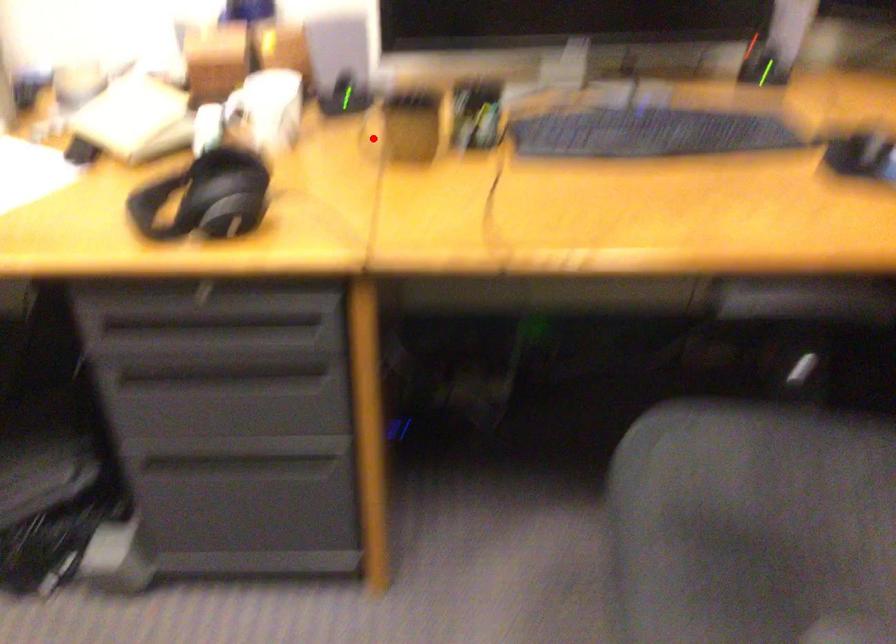
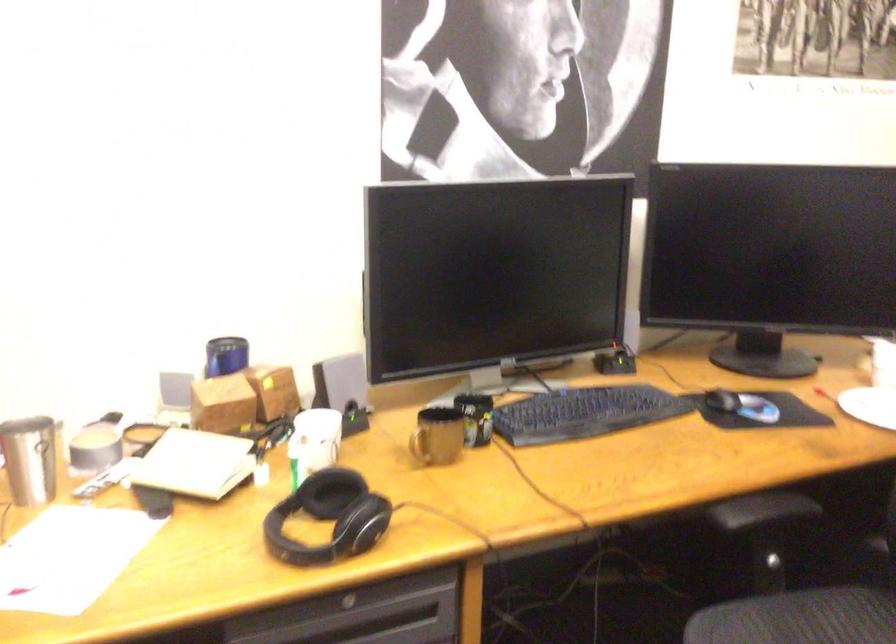
Where in the second image is the point corresponding to the highlighted location from the first image?

(419, 446)